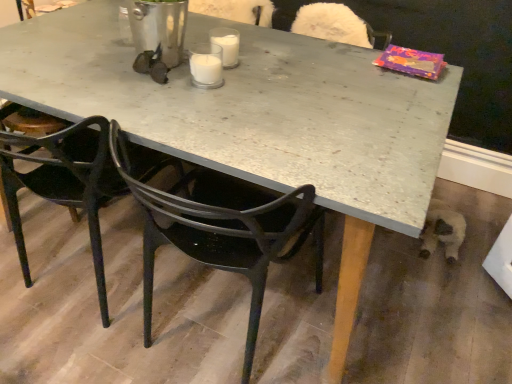
Question: Does point [225, 41] appear closer or farther from the camera than point [203, 64]?

Choices:
 (A) farther
 (B) closer

Answer: (A)

Question: Is white glass at center, the 1th coffee cup in the back-to-front sequence, taller or shorter than white glass candle at center, the second coffee cup positioned from the back?

Choices:
 (A) tall
 (B) short

Answer: (B)

Question: Considering the real-world distances, which object is closest to the white glass at center, the 2th coffee cup in the front-to-back sequence?

Choices:
 (A) black plastic chair at center, which is counted as the 1th chair, starting from the right
 (B) matte black chair at lower left, marked as the 2th chair in a right-to-left arrangement
 (C) white glass candle at center, which is the first coffee cup in front-to-back order

Answer: (C)

Question: Estimate the real-world distances between objects in this image. Which object is farther from the white glass at center, the 2th coffee cup in the front-to-back sequence?

Choices:
 (A) black plastic chair at center, which is counted as the 1th chair, starting from the right
 (B) white glass candle at center, the second coffee cup positioned from the back
 (C) matte black chair at lower left, marked as the 2th chair in a right-to-left arrangement

Answer: (C)